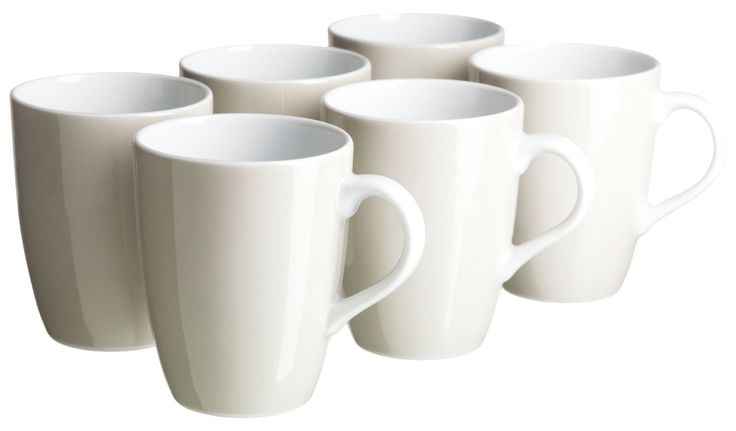
The height and width of the screenshot is (431, 736). Identify the location of coffee mugs. (79, 203), (174, 203), (261, 83), (460, 145), (570, 92), (417, 35).